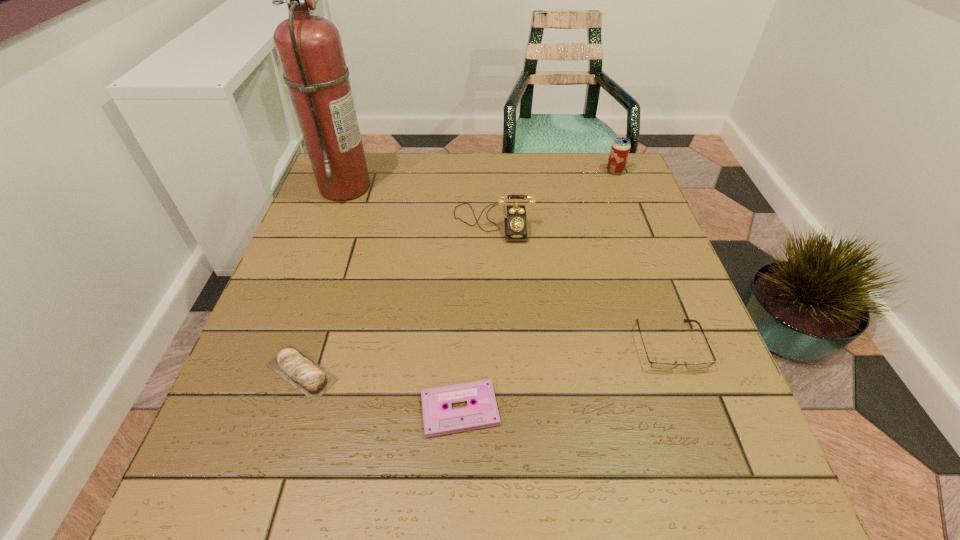
The image size is (960, 540). I want to click on vacant space that is in between the telephone and the videotape, so click(476, 316).

The height and width of the screenshot is (540, 960). Identify the location of vacant space in between the telephone and the videotape. coord(476,316).

Identify the location of free spot between the videotape and the fire extinguisher. (402, 298).

Where is `free space between the pita bread and the telephone`? free space between the pita bread and the telephone is located at coordinates point(397,298).

Identify the location of unoccupied position between the telephone and the pita bread. This screenshot has width=960, height=540. [x=397, y=298].

Locate an element on the screen. free space between the pita bread and the shortest object is located at coordinates (381, 391).

Locate an element on the screen. This screenshot has width=960, height=540. object that is the third closest one to the pita bread is located at coordinates (309, 47).

This screenshot has height=540, width=960. In order to click on object identified as the closest to the pita bread in this screenshot , I will do `click(483, 413)`.

Where is `vacant space that satisfies the following two spatial constraints: 1. on the back side of the pita bread; 2. on the front-facing side of the fire extinguisher`? vacant space that satisfies the following two spatial constraints: 1. on the back side of the pita bread; 2. on the front-facing side of the fire extinguisher is located at coordinates (362, 186).

The width and height of the screenshot is (960, 540). Identify the location of free space in the image that satisfies the following two spatial constraints: 1. on the front-facing side of the pita bread; 2. on the left side of the fire extinguisher. [277, 372].